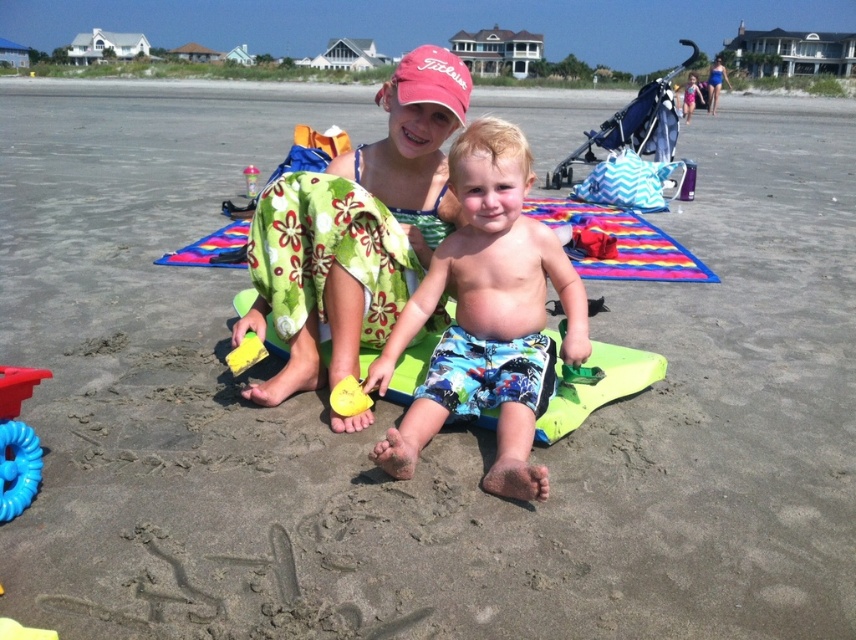
Question: Among these points, which one is nearest to the camera?

Choices:
 (A) (331, 355)
 (B) (317, 227)

Answer: (B)

Question: Considering the relative positions of printed cotton shorts at center and green floral towel at center in the image provided, where is printed cotton shorts at center located with respect to green floral towel at center?

Choices:
 (A) right
 (B) left

Answer: (A)

Question: Which object is the closest to the blue swimsuit at center?

Choices:
 (A) yellow foam at center
 (B) floral fabric dress at center
 (C) yellow plastic shovel at center

Answer: (C)

Question: Is printed cotton shorts at center positioned before green floral towel at center?

Choices:
 (A) no
 (B) yes

Answer: (B)

Question: Which is nearer to the printed cotton shorts at center?

Choices:
 (A) yellow plastic shovel at center
 (B) blue swimsuit at center
 (C) green floral towel at center

Answer: (C)

Question: Is rubber yellow toy at center to the right of yellow plastic shovel at center from the viewer's perspective?

Choices:
 (A) yes
 (B) no

Answer: (A)